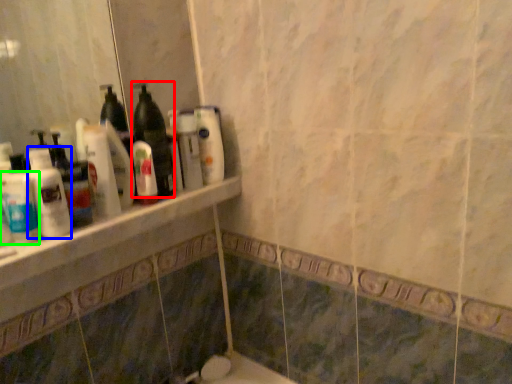
Question: Based on their relative distances, which object is farther from bottle (highlighted by a red box)? Choose from cleaning product (highlighted by a blue box) and mouthwash (highlighted by a green box).

Choices:
 (A) cleaning product
 (B) mouthwash

Answer: (B)